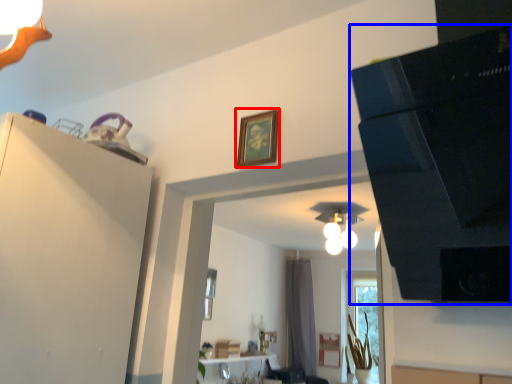
Question: Which object appears farthest to the camera in this image, picture frame (highlighted by a red box) or appliance (highlighted by a blue box)?

Choices:
 (A) picture frame
 (B) appliance

Answer: (A)